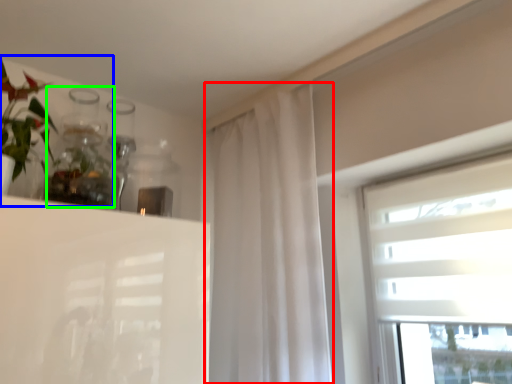
Question: Which object is the closest to the curtain (highlighted by a red box)? Choose among these: floral arrangement (highlighted by a blue box) or glass vase (highlighted by a green box).

Choices:
 (A) floral arrangement
 (B) glass vase

Answer: (B)